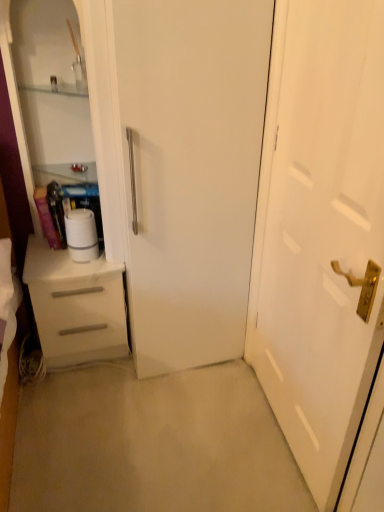
Question: Considering their positions, is white matte paper towel at left located in front of or behind white glossy door at center?

Choices:
 (A) front
 (B) behind

Answer: (B)

Question: From a real-world perspective, is white matte paper towel at left above or below white glossy door at center?

Choices:
 (A) above
 (B) below

Answer: (B)

Question: Which object is the closest to the white glossy door at center?

Choices:
 (A) white matte drawer at left
 (B) white glossy dresser at left
 (C) white matte paper towel at left

Answer: (B)

Question: Which object is positioned closest to the white glossy door at center?

Choices:
 (A) white matte paper towel at left
 (B) white glossy dresser at left
 (C) white matte drawer at left

Answer: (B)